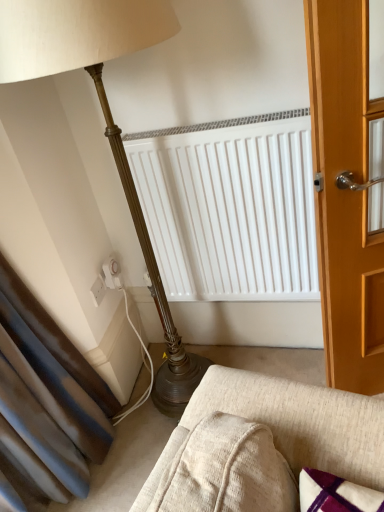
At what (x,y) coordinates should I click in order to perform the action: click on white plastic electric outlet at lower left, marked as the first electric outlet in a left-to-right arrangement. Please return your answer as a coordinate pair (x, y). The width and height of the screenshot is (384, 512). Looking at the image, I should click on (98, 290).

The height and width of the screenshot is (512, 384). What do you see at coordinates (112, 274) in the screenshot?
I see `white plastic electric outlet at lower left, which is the 1th electric outlet from right to left` at bounding box center [112, 274].

Locate an element on the screen. This screenshot has width=384, height=512. white plastic electric outlet at lower left, the 2th electric outlet when ordered from right to left is located at coordinates (98, 290).

Which is in front, point (121, 281) or point (92, 291)?

The point (92, 291) is closer.

Which of these two, white plastic electric outlet at lower left, the 2th electric outlet from the left, or white plastic electric outlet at lower left, marked as the first electric outlet in a left-to-right arrangement, stands taller?

With more height is white plastic electric outlet at lower left, the 2th electric outlet from the left.

Is white plastic electric outlet at lower left, which is the 1th electric outlet from right to left, facing away from white plastic electric outlet at lower left, the 2th electric outlet when ordered from right to left?

That's not correct — white plastic electric outlet at lower left, which is the 1th electric outlet from right to left, is not looking away from white plastic electric outlet at lower left, the 2th electric outlet when ordered from right to left.

This screenshot has height=512, width=384. In order to click on electric outlet on the left of white plastic electric outlet at lower left, the 2th electric outlet from the left in this screenshot , I will do `click(98, 290)`.

The image size is (384, 512). I want to click on studio couch located underneath the white plastic electric outlet at lower left, the 2th electric outlet from the left (from a real-world perspective), so click(265, 443).

From the picture: From a real-world perspective, who is located lower, textured beige fabric couch at lower center or white plastic electric outlet at lower left, the 2th electric outlet from the left?

textured beige fabric couch at lower center, from a real-world perspective.

Is textured beige fabric couch at lower center taller or shorter than white plastic electric outlet at lower left, which is the 1th electric outlet from right to left?

In the image, textured beige fabric couch at lower center appears to be shorter than white plastic electric outlet at lower left, which is the 1th electric outlet from right to left.

Can you see textured beige fabric couch at lower center touching white plastic electric outlet at lower left, which is the 1th electric outlet from right to left?

textured beige fabric couch at lower center and white plastic electric outlet at lower left, which is the 1th electric outlet from right to left, are clearly separated.

Considering the sizes of white plastic electric outlet at lower left, which is the 1th electric outlet from right to left, and textured beige fabric couch at lower center in the image, is white plastic electric outlet at lower left, which is the 1th electric outlet from right to left, taller or shorter than textured beige fabric couch at lower center?

white plastic electric outlet at lower left, which is the 1th electric outlet from right to left, is taller than textured beige fabric couch at lower center.

Does white plastic electric outlet at lower left, the 2th electric outlet from the left, have a larger size compared to textured beige fabric couch at lower center?

No, white plastic electric outlet at lower left, the 2th electric outlet from the left, is not bigger than textured beige fabric couch at lower center.

From a real-world perspective, count 2nd electric outlets upward from the textured beige fabric couch at lower center and point to it. Please provide its 2D coordinates.

[(112, 274)]

Is textured beige fabric couch at lower center at the back of white plastic electric outlet at lower left, which is the 1th electric outlet from right to left?

No, textured beige fabric couch at lower center is not at the back of white plastic electric outlet at lower left, which is the 1th electric outlet from right to left.

Find the location of a particular element. studio couch directly beneath the white plastic electric outlet at lower left, marked as the first electric outlet in a left-to-right arrangement (from a real-world perspective) is located at coordinates (265, 443).

Is point (225, 457) closer or farther from the camera than point (98, 279)?

Point (225, 457).

Who is bigger, textured beige fabric couch at lower center or white plastic electric outlet at lower left, marked as the first electric outlet in a left-to-right arrangement?

With larger size is textured beige fabric couch at lower center.

How many degrees apart are the facing directions of textured beige fabric couch at lower center and white plastic electric outlet at lower left, the 2th electric outlet when ordered from right to left?

84.7 degrees.

This screenshot has height=512, width=384. Identify the location of electric outlet that is the 1st object located above the textured beige fabric couch at lower center (from the image's perspective). (98, 290).

Considering the sizes of objects white plastic electric outlet at lower left, the 2th electric outlet when ordered from right to left, and textured beige fabric couch at lower center in the image provided, who is taller, white plastic electric outlet at lower left, the 2th electric outlet when ordered from right to left, or textured beige fabric couch at lower center?

white plastic electric outlet at lower left, the 2th electric outlet when ordered from right to left, is taller.

How different are the orientations of white plastic electric outlet at lower left, the 2th electric outlet when ordered from right to left, and textured beige fabric couch at lower center in degrees?

There is a 84.7-degree angle between the facing directions of white plastic electric outlet at lower left, the 2th electric outlet when ordered from right to left, and textured beige fabric couch at lower center.

Is point (100, 288) positioned before point (313, 415)?

That is False.

Is white plastic electric outlet at lower left, marked as the first electric outlet in a left-to-right arrangement, facing towards white plastic electric outlet at lower left, which is the 1th electric outlet from right to left?

No, white plastic electric outlet at lower left, marked as the first electric outlet in a left-to-right arrangement, is not aimed at white plastic electric outlet at lower left, which is the 1th electric outlet from right to left.

Between white plastic electric outlet at lower left, marked as the first electric outlet in a left-to-right arrangement, and white plastic electric outlet at lower left, the 2th electric outlet from the left, which one is positioned behind?

white plastic electric outlet at lower left, the 2th electric outlet from the left, is more distant.

Can you tell me how much white plastic electric outlet at lower left, the 2th electric outlet when ordered from right to left, and white plastic electric outlet at lower left, the 2th electric outlet from the left, differ in facing direction?

white plastic electric outlet at lower left, the 2th electric outlet when ordered from right to left, and white plastic electric outlet at lower left, the 2th electric outlet from the left, are facing 1.79 degrees away from each other.

Which is closer, (101, 297) or (114, 264)?

Point (101, 297) appears to be closer to the viewer than point (114, 264).

The height and width of the screenshot is (512, 384). I want to click on electric outlet below the white plastic electric outlet at lower left, which is the 1th electric outlet from right to left (from the image's perspective), so click(x=98, y=290).

Where is `electric outlet that is the 2nd object located above the textured beige fabric couch at lower center (from the image's perspective)`? The image size is (384, 512). electric outlet that is the 2nd object located above the textured beige fabric couch at lower center (from the image's perspective) is located at coordinates (112, 274).

Based on their spatial positions, is white plastic electric outlet at lower left, the 2th electric outlet from the left, or textured beige fabric couch at lower center further from white plastic electric outlet at lower left, the 2th electric outlet when ordered from right to left?

textured beige fabric couch at lower center is further to white plastic electric outlet at lower left, the 2th electric outlet when ordered from right to left.

Considering their positions, is white plastic electric outlet at lower left, the 2th electric outlet when ordered from right to left, positioned closer to textured beige fabric couch at lower center than white plastic electric outlet at lower left, which is the 1th electric outlet from right to left?

Based on the image, white plastic electric outlet at lower left, the 2th electric outlet when ordered from right to left, appears to be nearer to textured beige fabric couch at lower center.

Estimate the real-world distances between objects in this image. Which object is further from white plastic electric outlet at lower left, which is the 1th electric outlet from right to left, textured beige fabric couch at lower center or white plastic electric outlet at lower left, the 2th electric outlet when ordered from right to left?

textured beige fabric couch at lower center.

Looking at the image, which one is located closer to white plastic electric outlet at lower left, the 2th electric outlet when ordered from right to left, textured beige fabric couch at lower center or white plastic electric outlet at lower left, which is the 1th electric outlet from right to left?

white plastic electric outlet at lower left, which is the 1th electric outlet from right to left.

Based on their spatial positions, is white plastic electric outlet at lower left, the 2th electric outlet when ordered from right to left, or textured beige fabric couch at lower center further from white plastic electric outlet at lower left, which is the 1th electric outlet from right to left?

textured beige fabric couch at lower center is further to white plastic electric outlet at lower left, which is the 1th electric outlet from right to left.

Estimate the real-world distances between objects in this image. Which object is further from textured beige fabric couch at lower center, white plastic electric outlet at lower left, which is the 1th electric outlet from right to left, or white plastic electric outlet at lower left, marked as the first electric outlet in a left-to-right arrangement?

Among the two, white plastic electric outlet at lower left, which is the 1th electric outlet from right to left, is located further to textured beige fabric couch at lower center.

Find the location of a particular element. electric outlet between textured beige fabric couch at lower center and white plastic electric outlet at lower left, which is the 1th electric outlet from right to left, along the z-axis is located at coordinates (98, 290).